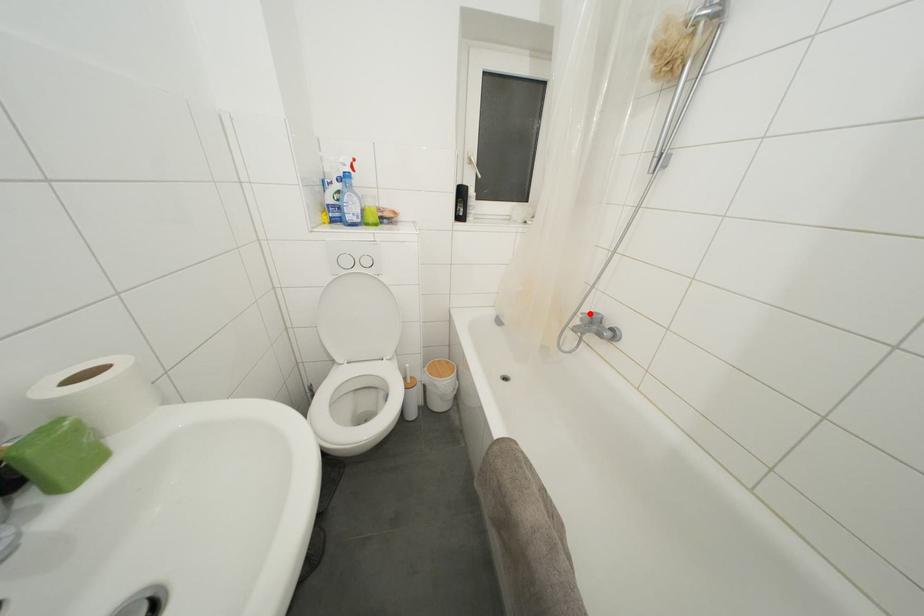
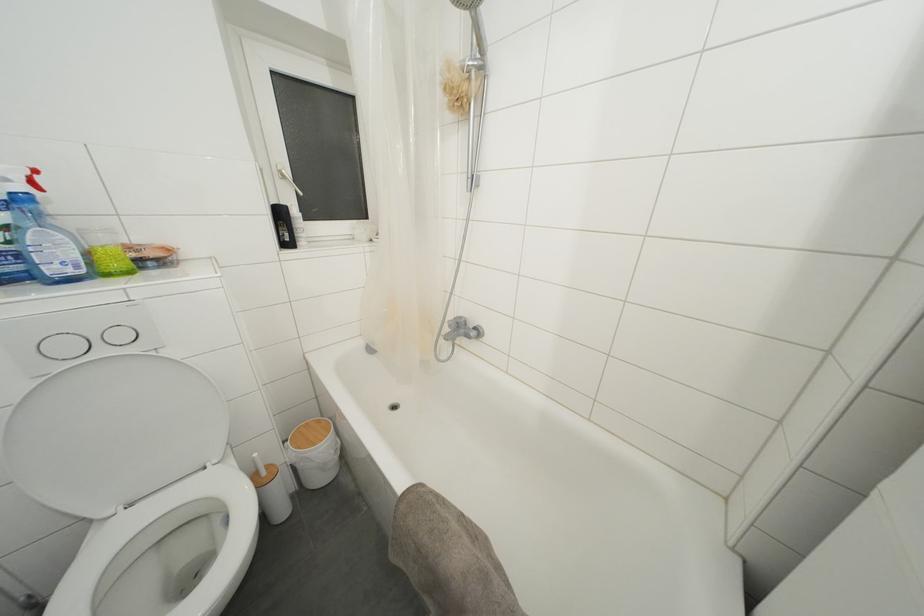
Question: I am providing you with two images of the same scene from different viewpoints. A red point is marked on the first image. At the location where the point appears in image 1, is it still visible in image 2?

Choices:
 (A) Yes
 (B) No

Answer: (A)